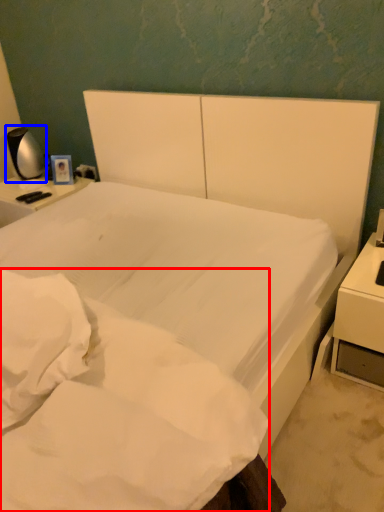
Question: Which of the following is the closest to the observer, mattress (highlighted by a red box) or bedside lamp (highlighted by a blue box)?

Choices:
 (A) mattress
 (B) bedside lamp

Answer: (A)